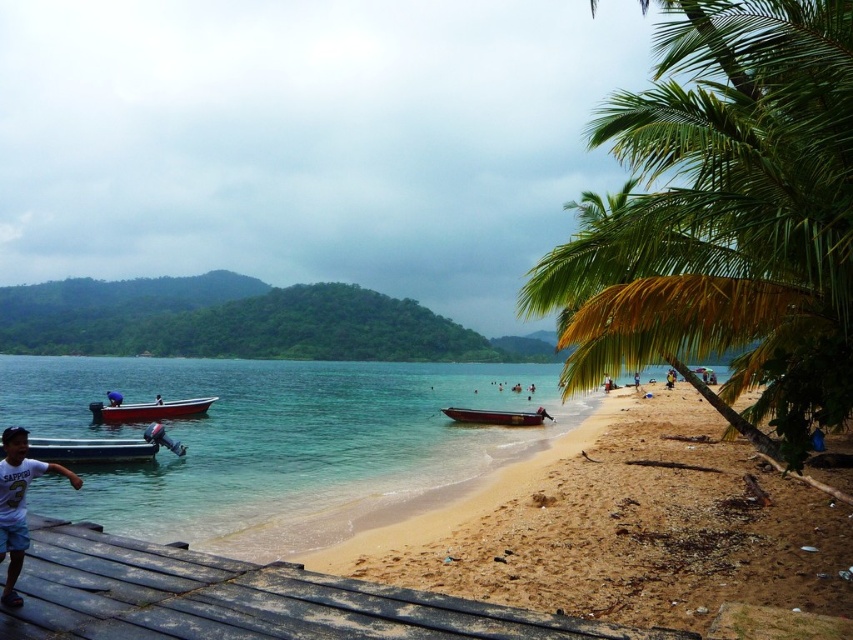
You are standing at the beach and want to take a photo of the two points mentioned. Which point, point (79,442) or point (108,394), will appear larger in your camera view?

Point (79,442) will appear larger in the camera view because it is closer to the camera than point (108,394).

You are a photographer standing at the center of the beach scene. You want to capture a photo of the weathered wood dock at lower left without including any boats in the shot. Based on their positions, is this possible?

The weathered wood dock at lower left is positioned at point (244, 600). Since the boats are anchored in the middle ground near the shore and the dock is at the lower left, it is possible to frame the shot so that the dock is visible while excluding the boats by adjusting the camera angle or zoom.

Consider the image. You are standing on the beach and want to place a new boat exactly where the white plastic boat at lower left is currently located. According to the coordinates provided, what are the coordinates where you should place your new boat?

You should place your new boat at the coordinates (91, 449), which is where the white plastic boat at lower left is located.